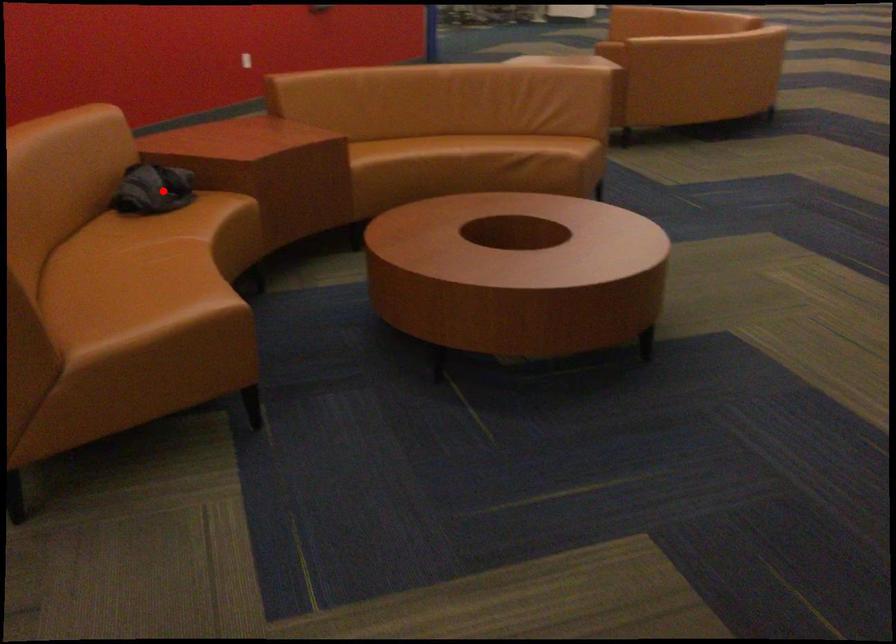
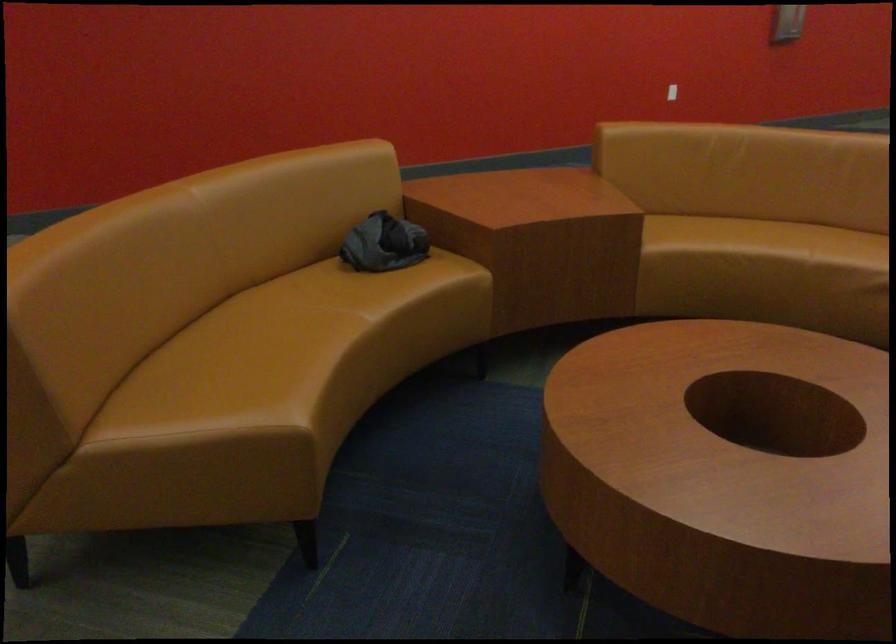
Question: I am providing you with two images of the same scene from different viewpoints. In image1, a red point is highlighted. Considering the same 3D point in image2, which of the following is correct?

Choices:
 (A) It is closer
 (B) It is farther

Answer: (A)